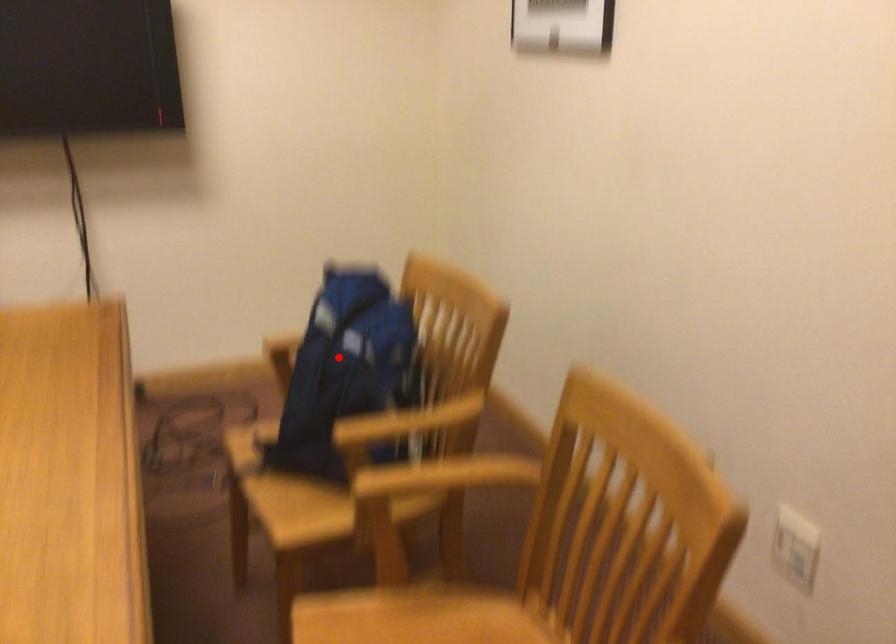
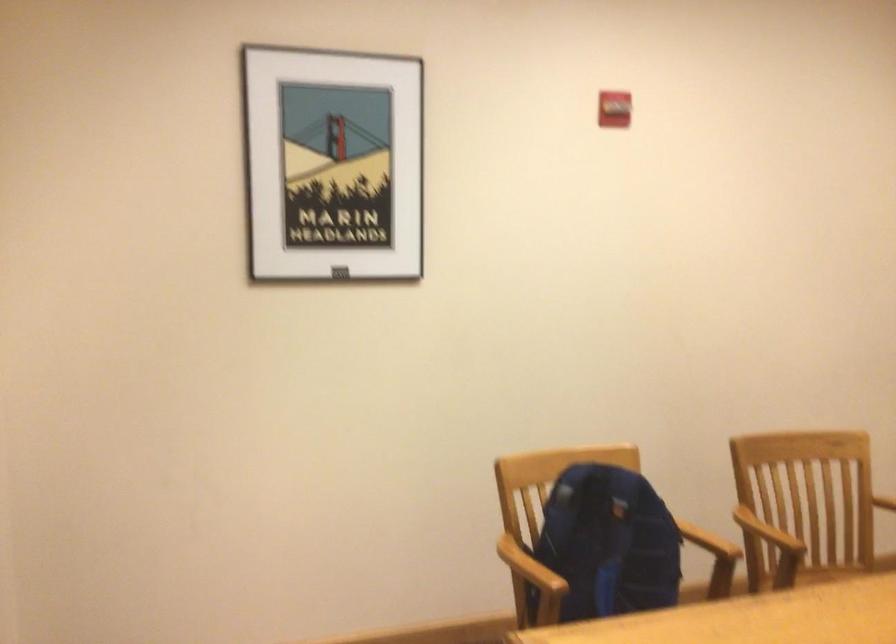
Locate, in the second image, the point that corresponds to the highlighted location in the first image.

(607, 544)